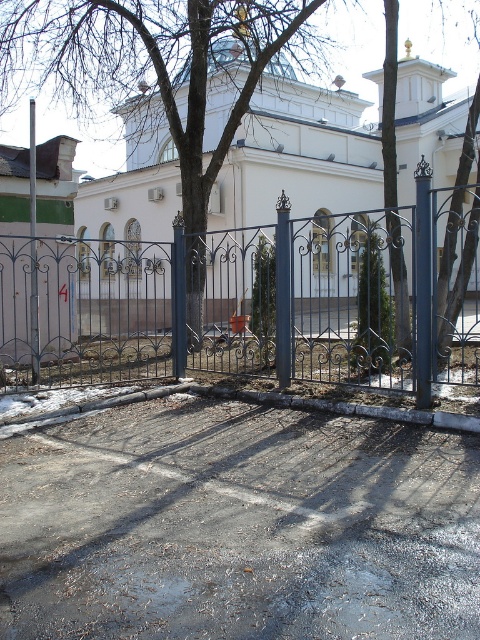
You are a delivery person with a cart that is 3 meters wide. You need to pass through the gap between the metallic wrought iron fence at center and the white matte fence at center. Can your cart fit through the gap?

The gap between the metallic wrought iron fence at center and the white matte fence at center is 3.24 meters. Since your cart is 3 meters wide, it can fit through the gap as the width of the gap is greater than the cart.